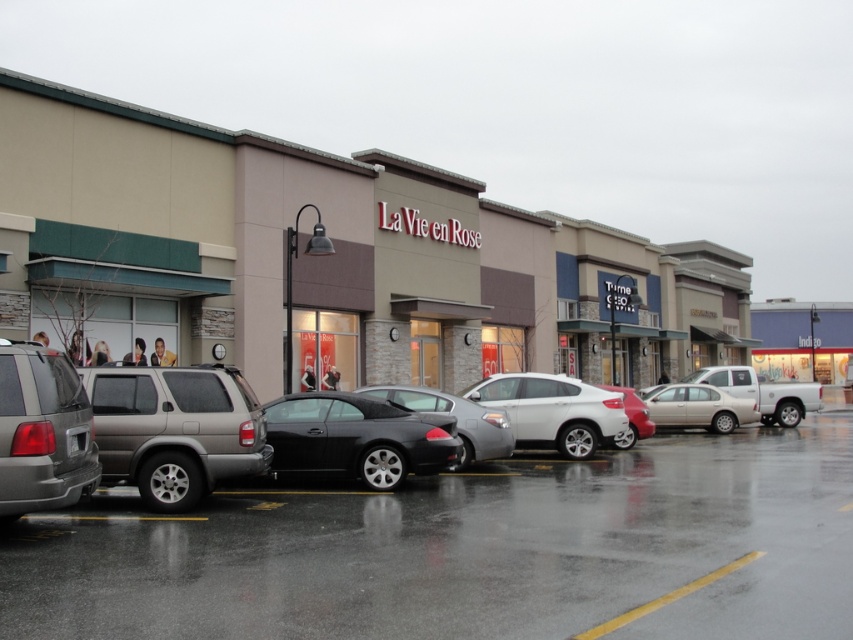
Question: Estimate the real-world distances between objects in this image. Which object is closer to the matte gray minivan at left?

Choices:
 (A) satin black sedan at center
 (B) shiny silver sedan at center
 (C) shiny black car at center

Answer: (B)

Question: Which object is farther from the camera taking this photo?

Choices:
 (A) matte silver suv at center-left
 (B) shiny silver sedan at center
 (C) shiny metallic car at center
 (D) matte gray minivan at left

Answer: (A)

Question: Does matte silver suv at center-left appear on the right side of shiny black car at center?

Choices:
 (A) yes
 (B) no

Answer: (B)

Question: Can you confirm if matte silver suv at center-left is bigger than matte gray minivan at left?

Choices:
 (A) yes
 (B) no

Answer: (A)

Question: Which of the following is the closest to the observer?

Choices:
 (A) (599, 416)
 (B) (706, 428)
 (C) (53, 461)

Answer: (C)

Question: Is matte gray minivan at left to the left of shiny black car at center from the viewer's perspective?

Choices:
 (A) no
 (B) yes

Answer: (B)